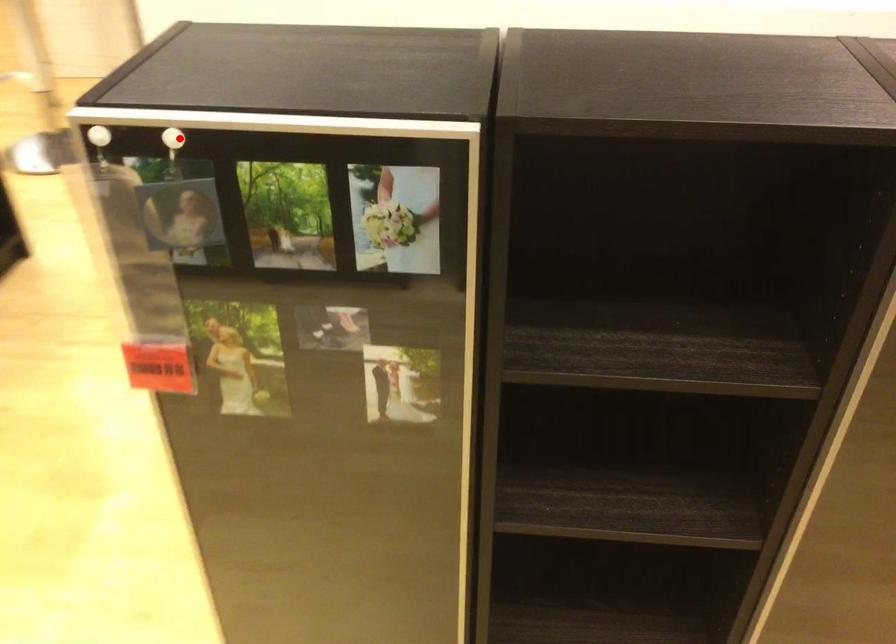
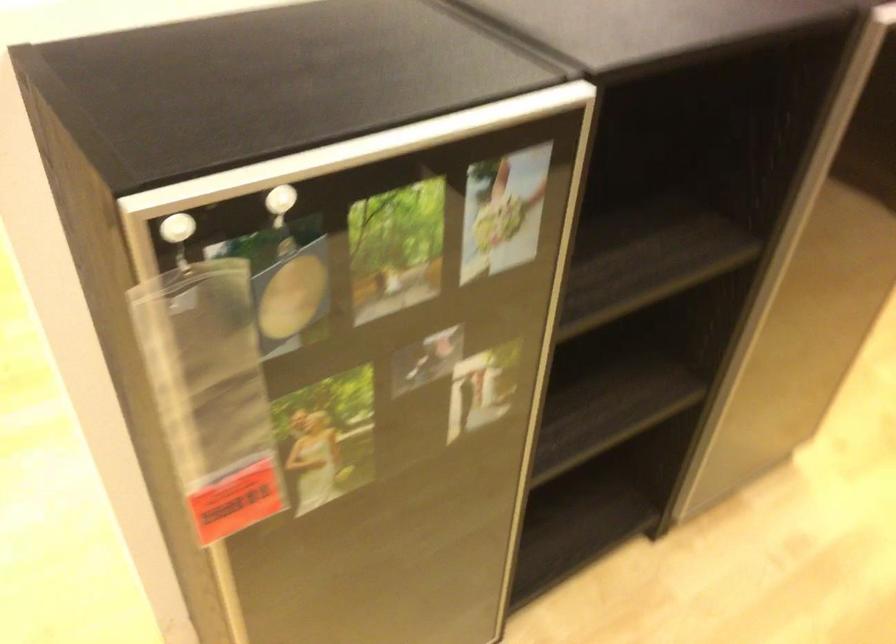
Question: I am providing you with two images of the same scene from different viewpoints. A red point is shown in image1. For the corresponding object point in image2, is it positioned nearer or farther from the camera?

Choices:
 (A) Nearer
 (B) Farther

Answer: (A)